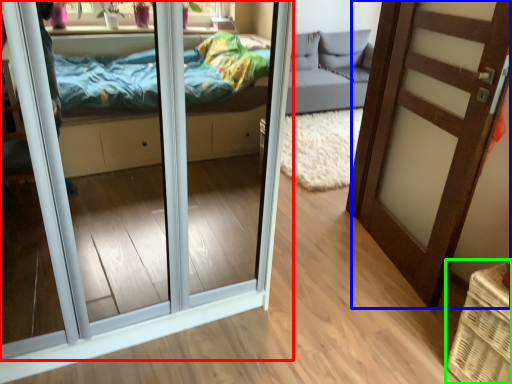
Question: Which is farther away from door (highlighted by a red box)? door (highlighted by a blue box) or basket (highlighted by a green box)?

Choices:
 (A) door
 (B) basket

Answer: (B)